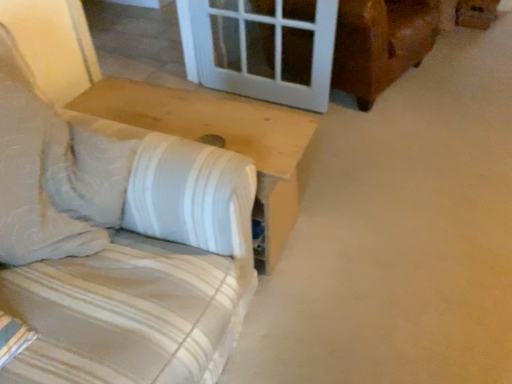
Question: Is white striped fabric couch at left inside or outside of brown cardboard box at upper right?

Choices:
 (A) inside
 (B) outside

Answer: (B)

Question: From the image's perspective, is white striped fabric couch at left positioned above or below brown cardboard box at upper right?

Choices:
 (A) below
 (B) above

Answer: (A)

Question: Based on their relative distances, which object is nearer to the white striped fabric couch at left?

Choices:
 (A) white wood table at lower left
 (B) brown cardboard box at upper right

Answer: (A)

Question: Considering the real-world distances, which object is closest to the white wood table at lower left?

Choices:
 (A) brown cardboard box at upper right
 (B) white striped fabric couch at left

Answer: (B)